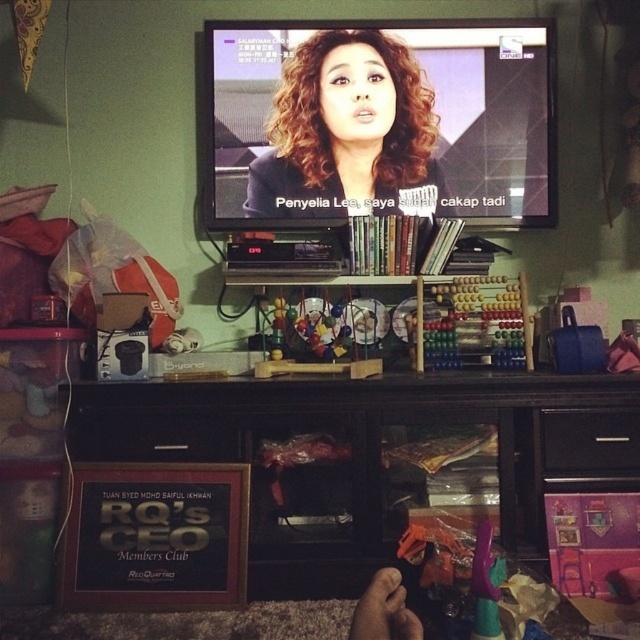
Does black wood dresser at lower center have a larger size compared to wooden abacus at center?

Yes.

Which is more to the left, black wood dresser at lower center or wooden abacus at center?

From the viewer's perspective, black wood dresser at lower center appears more on the left side.

Which is in front, point (541, 470) or point (419, 364)?

Point (541, 470) is in front.

Find the location of `black wood dresser at lower center`. black wood dresser at lower center is located at coordinates (369, 452).

Which is more to the right, matte black hair at center or wooden abacus at center?

From the viewer's perspective, wooden abacus at center appears more on the right side.

Between matte black hair at center and wooden abacus at center, which one has less height?

wooden abacus at center

Which is in front, point (252, 180) or point (451, 340)?

Point (451, 340) is in front.

The height and width of the screenshot is (640, 640). I want to click on matte black hair at center, so click(346, 131).

Consider the image. Which is more to the right, black wood dresser at lower center or matte black hair at center?

Positioned to the right is black wood dresser at lower center.

Is black wood dresser at lower center to the right of matte black hair at center from the viewer's perspective?

Yes, black wood dresser at lower center is to the right of matte black hair at center.

This screenshot has height=640, width=640. I want to click on black wood dresser at lower center, so click(369, 452).